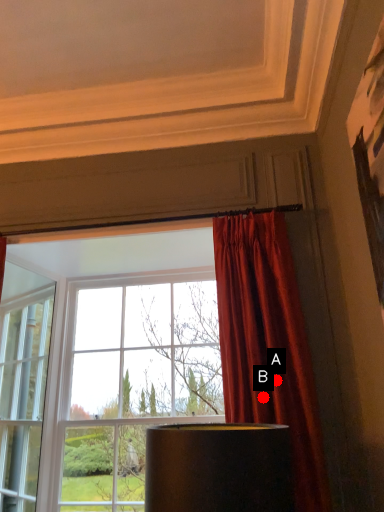
Question: Two points are circled on the image, labeled by A and B beside each circle. Which point is closer to the camera?

Choices:
 (A) A is closer
 (B) B is closer

Answer: (B)